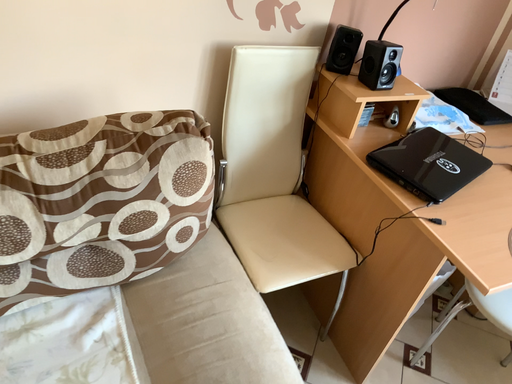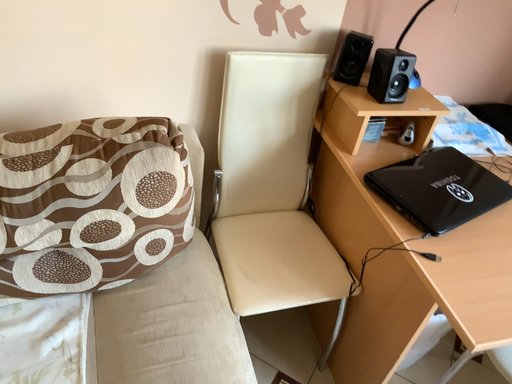
Question: Which way did the camera rotate in the video?

Choices:
 (A) rotated right
 (B) rotated left

Answer: (B)